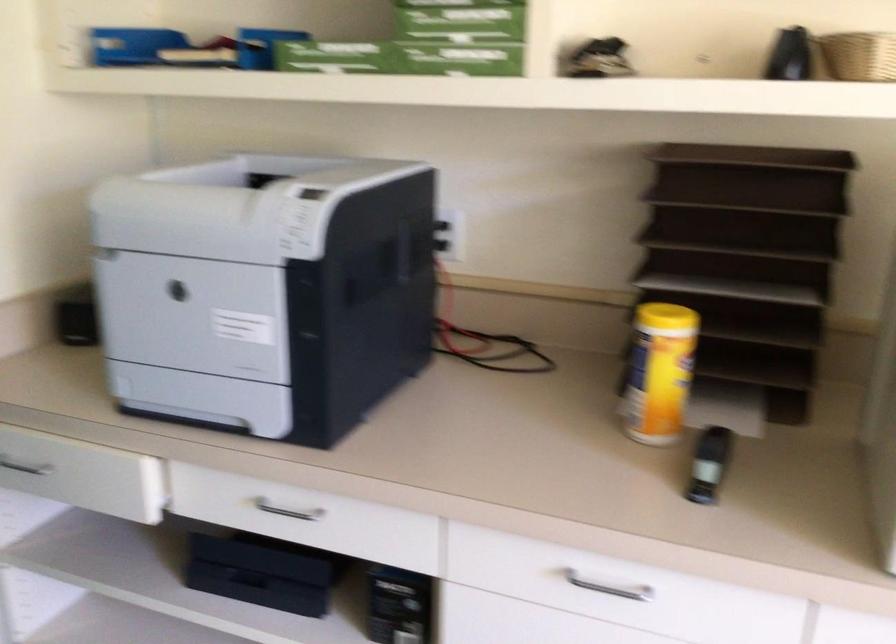
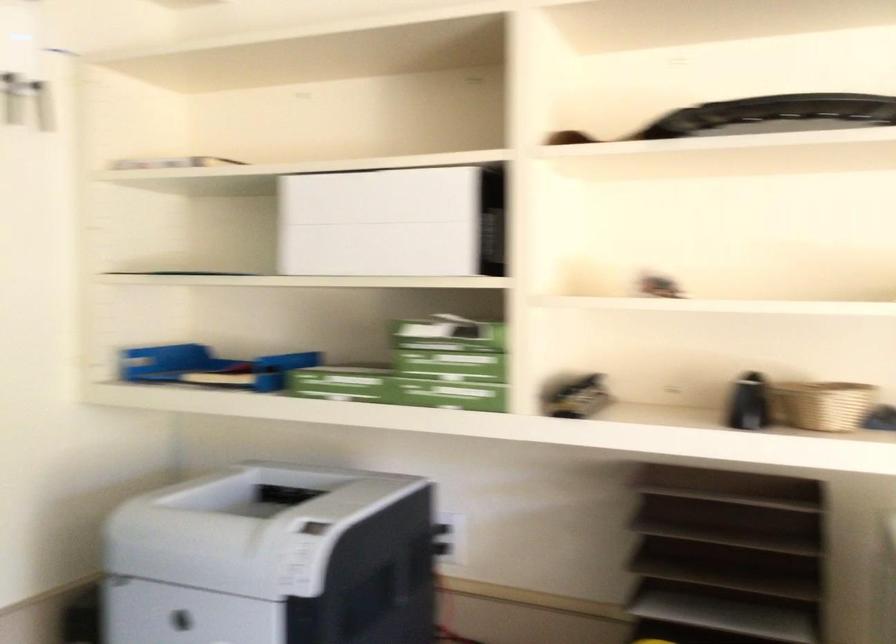
The point at (243, 194) is marked in the first image. Where is the corresponding point in the second image?

(246, 527)